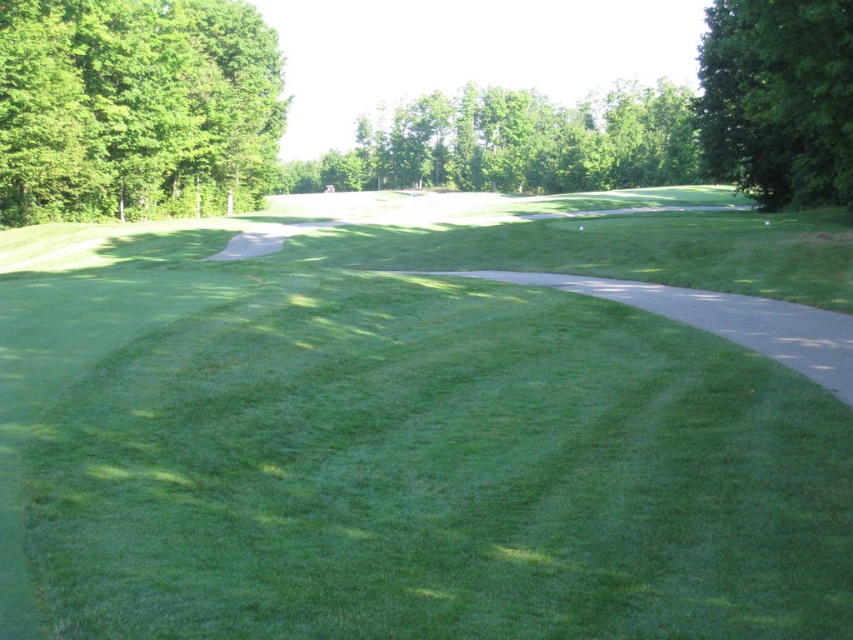
Question: Which of the following is the closest to the observer?

Choices:
 (A) green leafy tree at upper right
 (B) green leafy tree at upper center
 (C) green leafy tree at left

Answer: (A)

Question: Considering the real-world distances, which object is farthest from the green leafy tree at left?

Choices:
 (A) green leafy tree at upper center
 (B) green leafy tree at upper right

Answer: (A)

Question: Can you confirm if green leafy tree at upper center is thinner than green leafy tree at upper right?

Choices:
 (A) yes
 (B) no

Answer: (B)

Question: Estimate the real-world distances between objects in this image. Which object is farther from the green leafy tree at left?

Choices:
 (A) green leafy tree at upper right
 (B) green grass at center
 (C) green leafy tree at upper center

Answer: (C)

Question: Is green leafy tree at left above green leafy tree at upper center?

Choices:
 (A) no
 (B) yes

Answer: (A)

Question: Observing the image, what is the correct spatial positioning of green grass at center in reference to green leafy tree at upper center?

Choices:
 (A) right
 (B) left

Answer: (B)